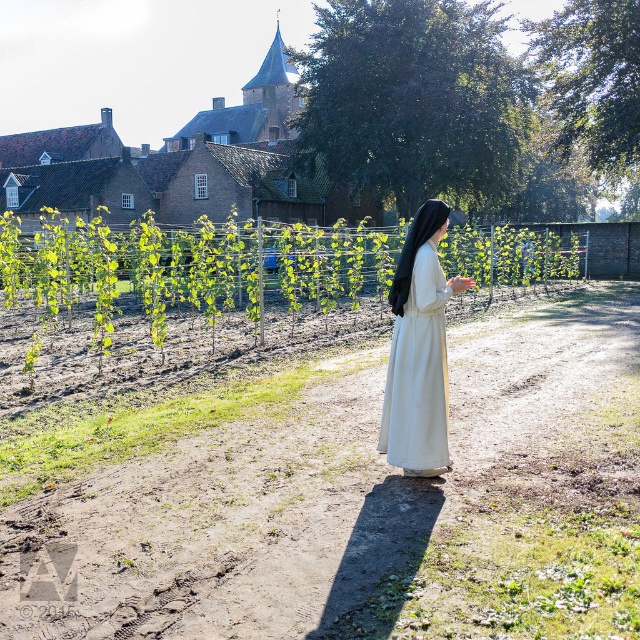
The width and height of the screenshot is (640, 640). Find the location of `green leafy vine at center`. green leafy vine at center is located at coordinates (192, 268).

Measure the distance from green leafy vine at center to white cotton dress at center.

green leafy vine at center and white cotton dress at center are 20.15 meters apart.

Is point (204, 314) positioned before point (426, 422)?

No, (204, 314) is further to viewer.

You are a GUI agent. You are given a task and a screenshot of the screen. Output one action in this format:
    pyautogui.click(x=<x>, y=<y>)
    Task: Click on the green leafy vine at center
    This screenshot has height=640, width=640.
    Given the screenshot: What is the action you would take?
    pyautogui.click(x=192, y=268)